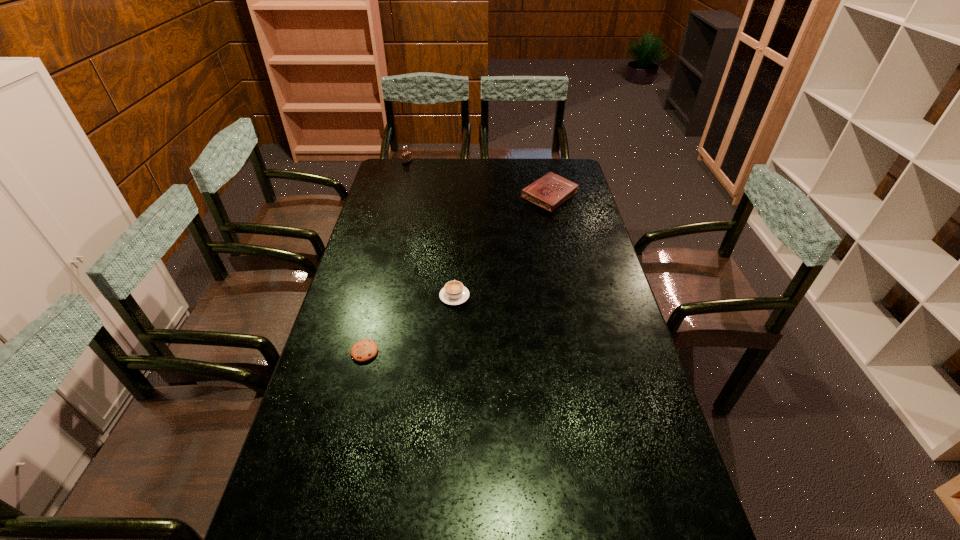
You are a GUI agent. You are given a task and a screenshot of the screen. Output one action in this format:
    pyautogui.click(x=<x>, y=<y>)
    Task: Click on the free location that satisfies the following two spatial constraints: 1. on the front side of the nearest object; 2. on the right side of the padlock
    The image size is (960, 540).
    Given the screenshot: What is the action you would take?
    pyautogui.click(x=359, y=352)

I want to click on vacant area in the image that satisfies the following two spatial constraints: 1. on the side of the third nearest object with the handle; 2. on the left side of the cappuccino, so click(461, 196).